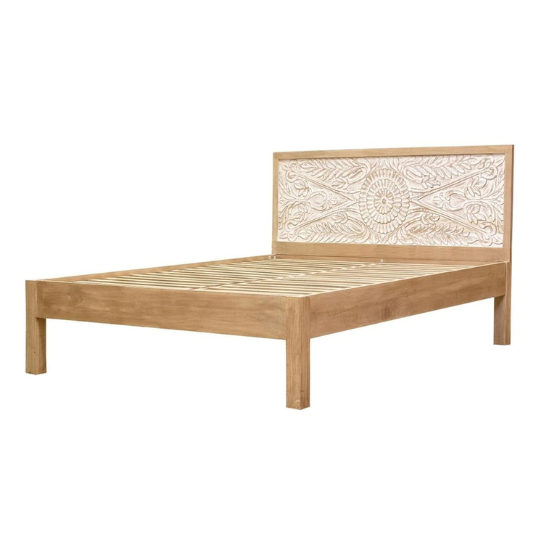
Identify the location of front right bed leg. (34, 342).